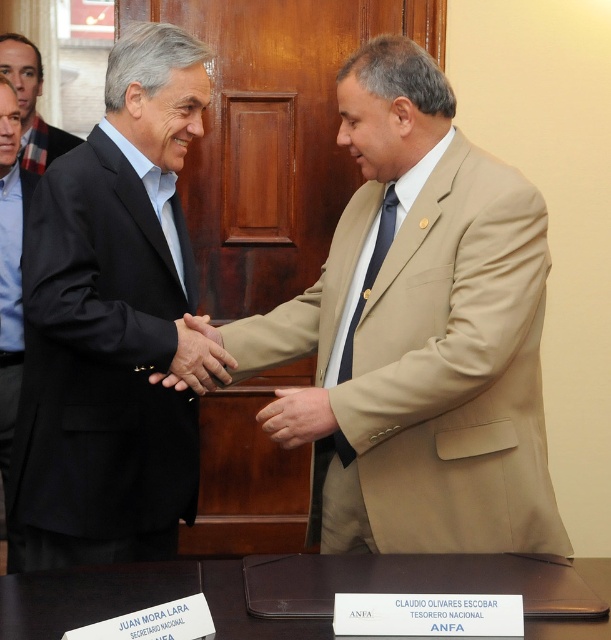
You are a photographer at the event and want to ensure that both the matte black suit at center and the tan fabric hand at center are clearly visible in your photo. Based on their positions, which one might be partially obscured if you focus on the other?

The matte black suit at center is in front of the tan fabric hand at center, so focusing on the matte black suit at center might partially obscure the tan fabric hand at center.